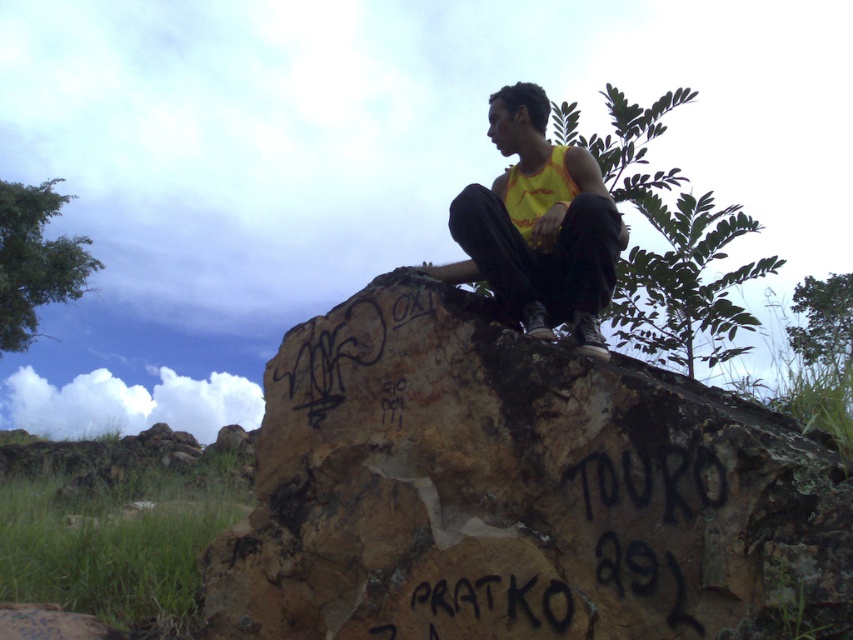
Question: Is brown rough rock at upper center below yellow fabric tank top at center?

Choices:
 (A) no
 (B) yes

Answer: (B)

Question: Which point appears closest to the camera in this image?

Choices:
 (A) (393, 371)
 (B) (555, 173)

Answer: (A)

Question: Is brown rough rock at upper center behind yellow fabric tank top at center?

Choices:
 (A) yes
 (B) no

Answer: (B)

Question: Is brown rough rock at upper center above yellow fabric tank top at center?

Choices:
 (A) no
 (B) yes

Answer: (A)